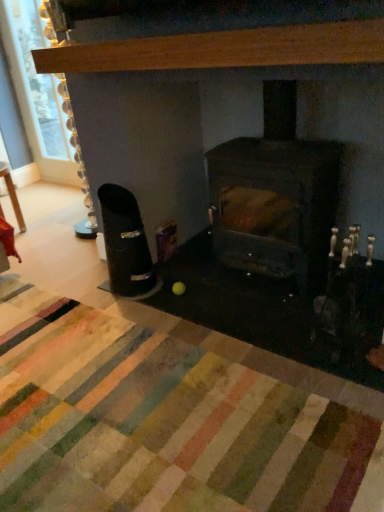
You are a GUI agent. You are given a task and a screenshot of the screen. Output one action in this format:
    pyautogui.click(x=<x>, y=<y>)
    Task: Click on the vacant space that's between dark brown wood burning stove at center and black plastic ashtray at left
    The image size is (384, 512).
    Given the screenshot: What is the action you would take?
    pyautogui.click(x=200, y=287)